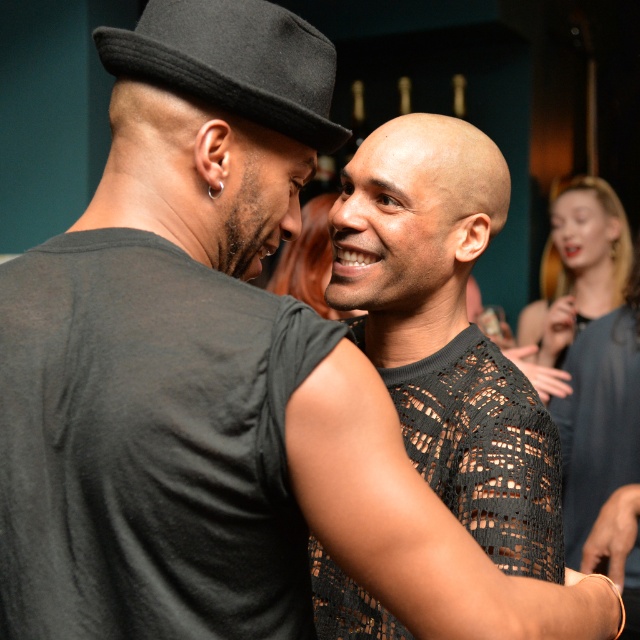
Between black mesh shirt at center and blonde hair at upper right, which one has more height?

black mesh shirt at center is taller.

Can you confirm if black mesh shirt at center is thinner than blonde hair at upper right?

Correct, black mesh shirt at center's width is less than blonde hair at upper right's.

Does point (403, 252) come behind point (570, 278)?

That is False.

Identify the location of black mesh shirt at center. The height and width of the screenshot is (640, 640). (445, 332).

Can you confirm if black felt fedora at upper left is bigger than smooth blonde hair at center?

No, black felt fedora at upper left is not bigger than smooth blonde hair at center.

Is black felt fedora at upper left wider than smooth blonde hair at center?

In fact, black felt fedora at upper left might be narrower than smooth blonde hair at center.

Measure the distance between point (305,108) and camera.

Point (305,108) and camera are 1.08 meters apart.

The width and height of the screenshot is (640, 640). What are the coordinates of `black felt fedora at upper left` in the screenshot? It's located at (234, 61).

Does black mesh shirt at center come behind smooth blonde hair at center?

No.

Find the location of `black mesh shirt at center`. black mesh shirt at center is located at coordinates (445, 332).

What do you see at coordinates (445, 332) in the screenshot? I see `black mesh shirt at center` at bounding box center [445, 332].

Find the location of `black mesh shirt at center`. black mesh shirt at center is located at coordinates (445, 332).